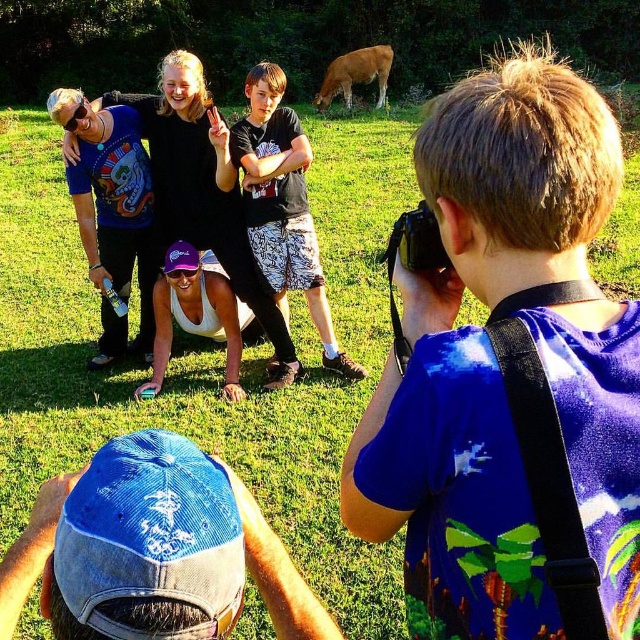
You are standing at the camera position and want to know which of the two points, point 1 at coordinates (289, 157) or point 2 at (381, 54), is closer to you. Which one is it?

Point 1 at coordinates (289, 157) is closer to the viewer than point 2 at (381, 54).

You are standing in the grassy field and want to take a photo of the brown furry cow at upper center. There is a person with a black cotton shirt at center in the way. Can you move around them to get a clear shot?

The black cotton shirt at center is positioned on the left side of the brown furry cow at upper center, so you can move to the right side of the black cotton shirt at center to get a clear view of the brown furry cow at upper center.